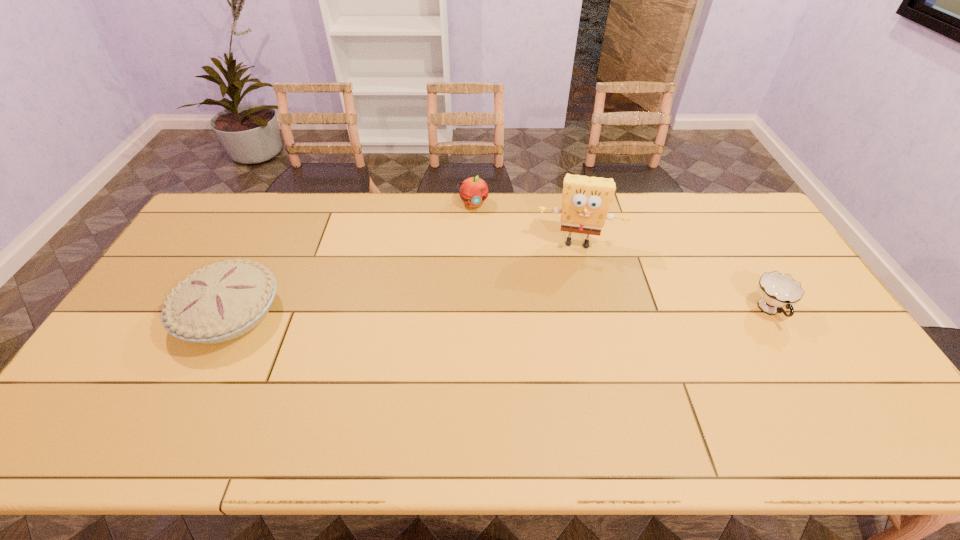
Locate an element on the screen. vacant space situated 0.380m on the surface of the apple is located at coordinates (497, 288).

This screenshot has height=540, width=960. In order to click on free spot located 0.380m on the face of the third nearest object in this screenshot , I will do `click(564, 350)`.

This screenshot has height=540, width=960. What are the coordinates of `free location located 0.200m on the face of the third nearest object` in the screenshot? It's located at (567, 300).

Locate an element on the screen. This screenshot has width=960, height=540. free region located 0.370m on the face of the third nearest object is located at coordinates (564, 347).

In order to click on apple that is at the far edge in this screenshot , I will do `click(473, 191)`.

Identify the location of sponge at the far edge. (586, 200).

Image resolution: width=960 pixels, height=540 pixels. I want to click on object located in the left edge section of the desktop, so click(x=225, y=300).

Where is `object at the right edge`? This screenshot has width=960, height=540. object at the right edge is located at coordinates (776, 290).

Where is `vacant space at the far edge of the desktop`? This screenshot has height=540, width=960. vacant space at the far edge of the desktop is located at coordinates (504, 192).

This screenshot has height=540, width=960. What are the coordinates of `vacant space at the near edge of the desktop` in the screenshot? It's located at (451, 392).